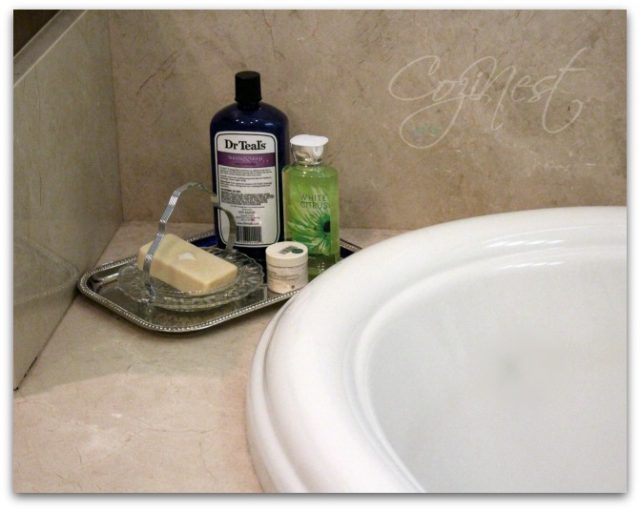
Identify the location of tray. The image size is (640, 510). (178, 327).